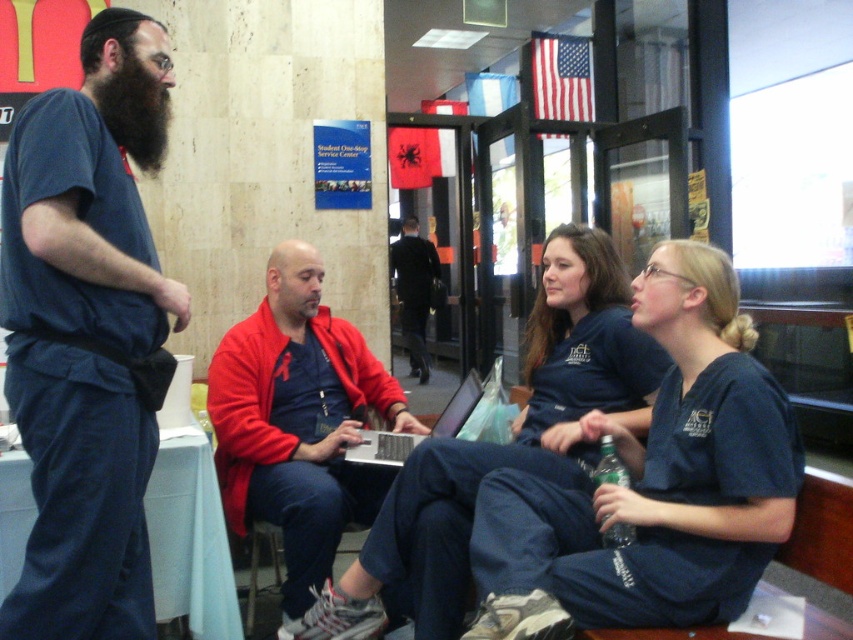
Question: Considering the real-world distances, which object is closest to the blue scrubs at center?

Choices:
 (A) black matte beard at upper left
 (B) silver metallic laptop at center
 (C) blue denim pants at center
 (D) dark blue suit at center

Answer: (B)

Question: Is matte blue shirt at center behind black matte beard at upper left?

Choices:
 (A) no
 (B) yes

Answer: (B)

Question: Does black matte beard at upper left have a lesser width compared to dark blue suit at center?

Choices:
 (A) no
 (B) yes

Answer: (B)

Question: Which point is farther from the camera taking this photo?

Choices:
 (A) tap(438, 552)
 (B) tap(422, 355)
 (C) tap(138, 157)
 (D) tap(364, 448)

Answer: (B)

Question: Can you confirm if black matte beard at upper left is positioned below silver metallic laptop at center?

Choices:
 (A) no
 (B) yes

Answer: (A)

Question: Which point is closer to the camera?

Choices:
 (A) silver metallic laptop at center
 (B) blue scrubs at center
 (C) matte blue shirt at center
 (D) black matte beard at upper left

Answer: (B)